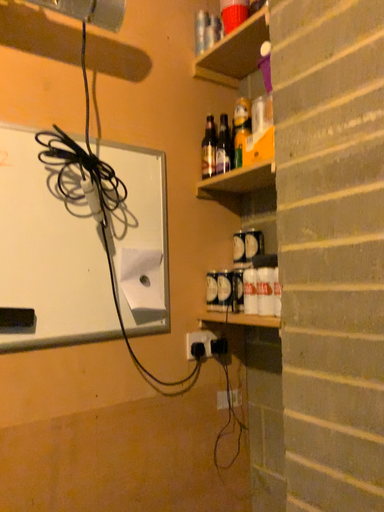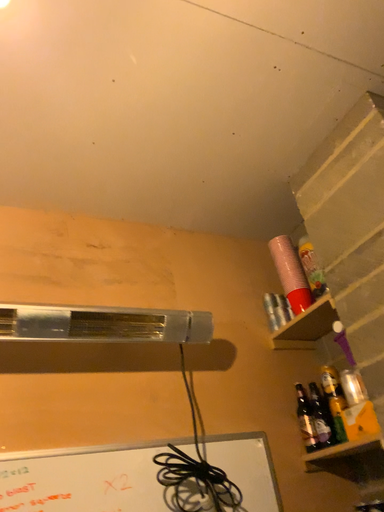
Question: How did the camera likely rotate when shooting the video?

Choices:
 (A) rotated upward
 (B) rotated downward

Answer: (A)